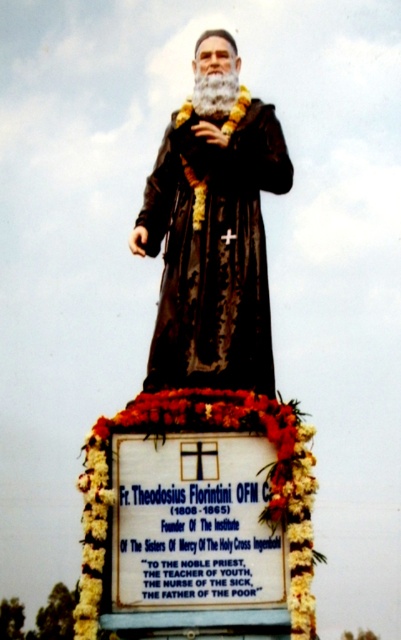
What is the position of the matte black robe at center relative to the floral garland at bottom?

The matte black robe at center is positioned to the right of the floral garland at bottom.

What is the relationship between the width of the black matte statue at center and the floral garland at bottom?

The black matte statue at center is thinner than the floral garland at bottom.